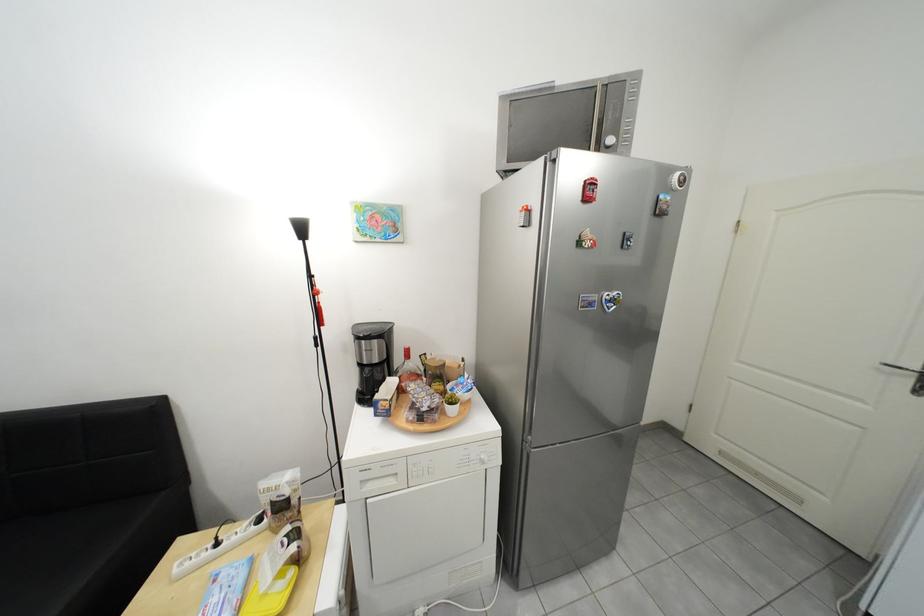
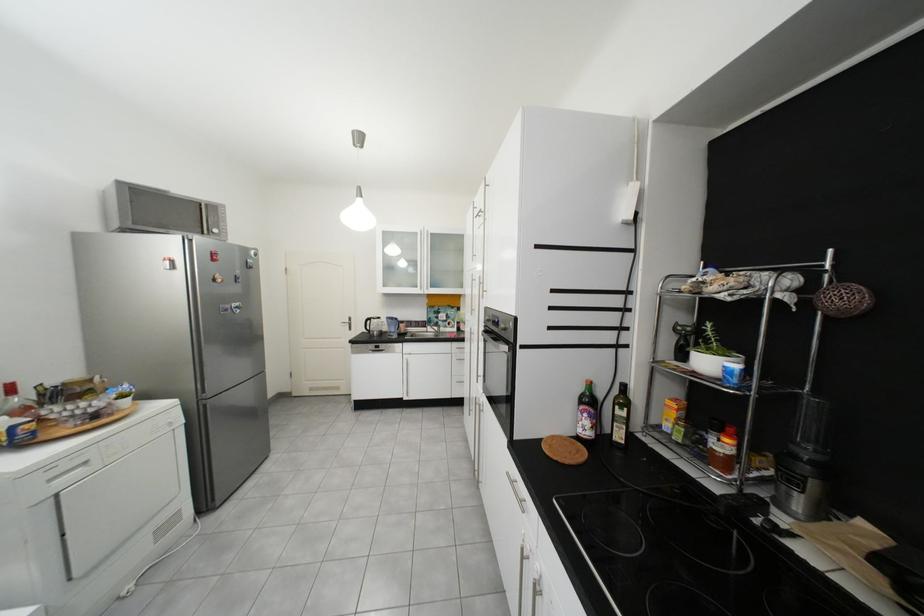
In the second image, find the point that corresponds to pixel 602 305 in the first image.

(237, 310)